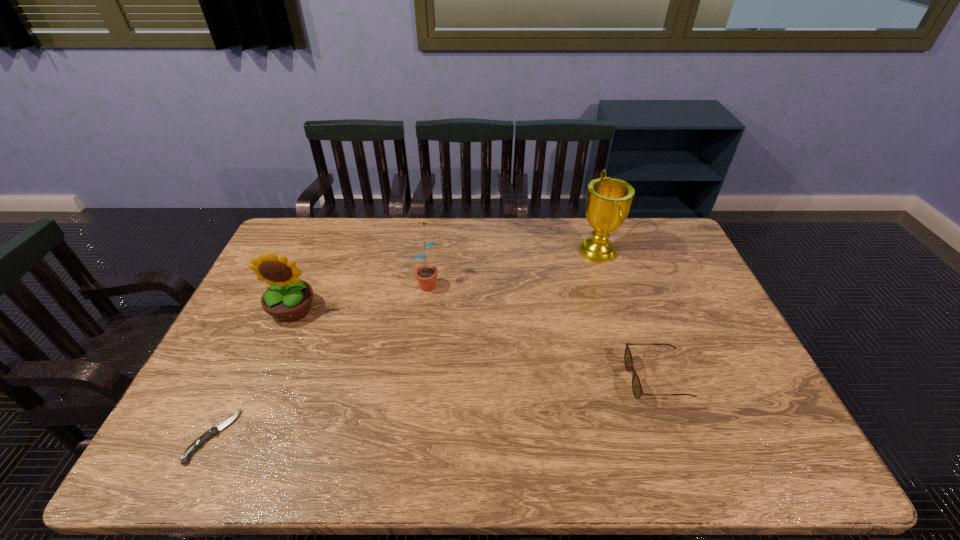
This screenshot has height=540, width=960. I want to click on award, so click(x=608, y=201).

In order to click on the right sunflower in this screenshot , I will do `click(426, 275)`.

At what (x,y) coordinates should I click in order to perform the action: click on the left sunflower. Please return your answer as a coordinate pair (x, y). Image resolution: width=960 pixels, height=540 pixels. Looking at the image, I should click on (289, 298).

Find the location of a particular element. The image size is (960, 540). the fourth farthest object is located at coordinates (637, 390).

The width and height of the screenshot is (960, 540). What are the coordinates of `the second shortest object` in the screenshot? It's located at (637, 390).

This screenshot has height=540, width=960. Find the location of `the nearest object`. the nearest object is located at coordinates (x=214, y=431).

Find the location of a particular element. This screenshot has height=540, width=960. pocketknife is located at coordinates (214, 431).

Locate an element on the screen. This screenshot has height=540, width=960. free spot located on the shiny surface of the award is located at coordinates (492, 252).

At what (x,y) coordinates should I click in order to perform the action: click on vacant space located on the shiny surface of the award. Please return your answer as a coordinate pair (x, y). The height and width of the screenshot is (540, 960). Looking at the image, I should click on (494, 252).

Find the location of a particular element. The image size is (960, 540). free space located 0.140m on the shiny surface of the award is located at coordinates (538, 252).